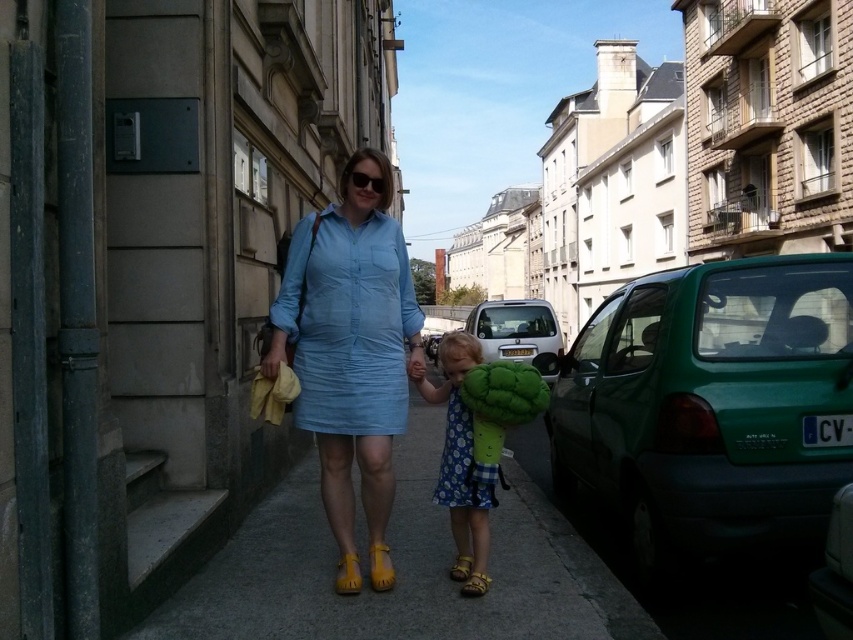
Question: Can you confirm if light blue cotton dress at center is smaller than floral cotton dress at center?

Choices:
 (A) yes
 (B) no

Answer: (B)

Question: Which object is farther from the camera taking this photo?

Choices:
 (A) green matte car at right
 (B) smooth concrete pavement at center

Answer: (A)

Question: Which of the following is the closest to the observer?

Choices:
 (A) smooth concrete pavement at center
 (B) green plush backpack at center

Answer: (A)

Question: Estimate the real-world distances between objects in this image. Which object is closer to the green plush backpack at center?

Choices:
 (A) matte blue dress at center
 (B) green matte car at right
 (C) light blue cotton dress at center

Answer: (A)

Question: Does smooth concrete pavement at center have a larger size compared to white matte car at center?

Choices:
 (A) yes
 (B) no

Answer: (B)

Question: Is white matte car at center thinner than floral cotton dress at center?

Choices:
 (A) yes
 (B) no

Answer: (B)